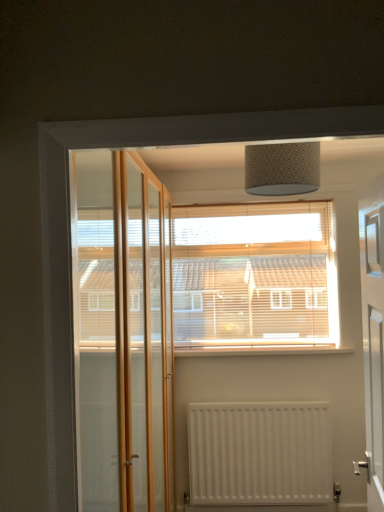
Where is `free point above wooden blinds at center (from a real-world perspective)`? The width and height of the screenshot is (384, 512). free point above wooden blinds at center (from a real-world perspective) is located at coordinates tap(274, 201).